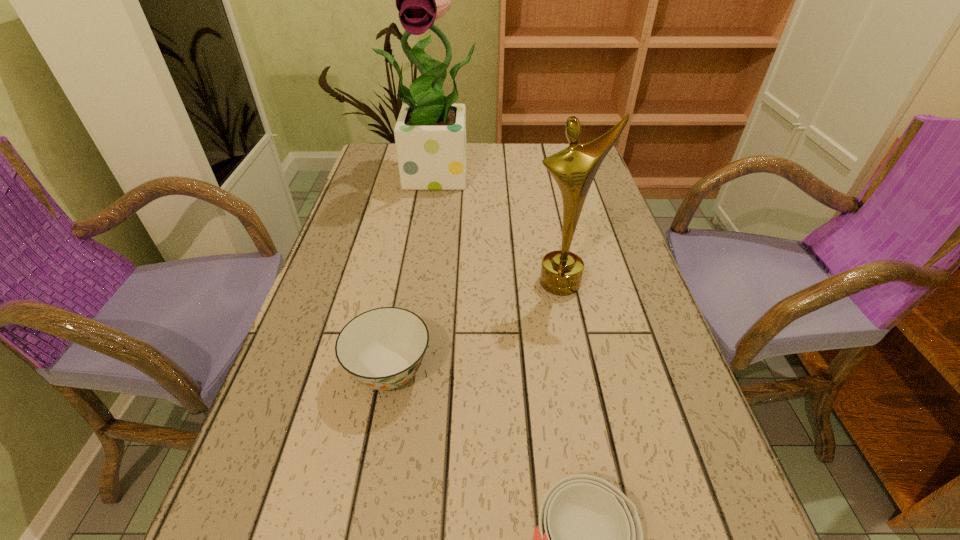
The image size is (960, 540). I want to click on the farthest object, so pos(430,133).

The height and width of the screenshot is (540, 960). Find the location of `flower arrangement`. flower arrangement is located at coordinates (430, 133).

Locate an element on the screen. the third nearest object is located at coordinates (574, 168).

Identify the location of award. This screenshot has width=960, height=540. (574, 168).

Locate an element on the screen. The height and width of the screenshot is (540, 960). the left soup bowl is located at coordinates (382, 348).

Find the location of `the second shortest object`. the second shortest object is located at coordinates pyautogui.click(x=382, y=348).

You are a GUI agent. You are given a task and a screenshot of the screen. Output one action in this format:
    pyautogui.click(x=<x>, y=<y>)
    Task: Click on the vacant space located 0.370m on the front-facing side of the flower arrangement
    
    Given the screenshot: What is the action you would take?
    pyautogui.click(x=428, y=287)

Locate an element on the screen. free space located 0.380m on the front-facing side of the third nearest object is located at coordinates (599, 468).

I want to click on vacant position located 0.290m on the back of the farther soup bowl, so click(x=412, y=248).

You are a GUI agent. You are given a task and a screenshot of the screen. Output one action in this format:
    pyautogui.click(x=<x>, y=<y>)
    Task: Click on the object located in the far edge section of the desktop
    This screenshot has width=960, height=540.
    Given the screenshot: What is the action you would take?
    430,133